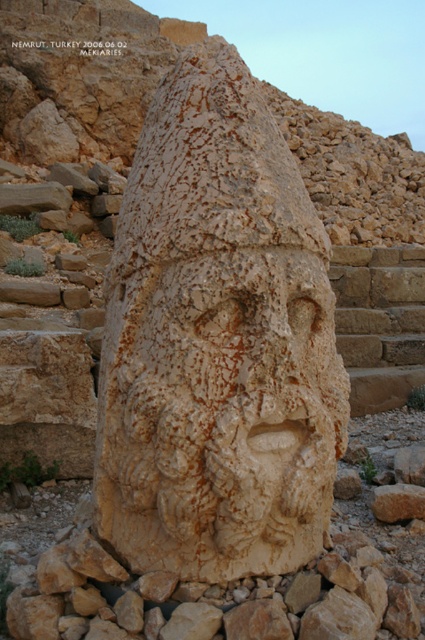
You are an archaeologist examining the ancient site. You notice the brown stone stairs at center and the black text at upper center. Which object is closer to you from your current viewpoint?

The brown stone stairs at center is closer to you because it is in front of the black text at upper center.

You are a photographer standing at the base of the stone head sculpture. You want to take a photo that includes both the point at coordinates point(363, 307) and point(11, 38). Which point will appear larger in the photo?

Point(363, 307) is closer to the camera than point(11, 38), so it will appear larger in the photo.